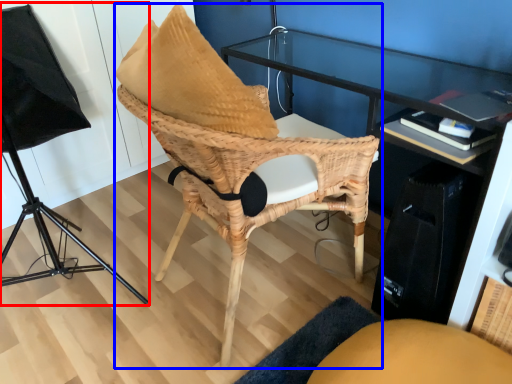
Question: Which point is further to the camera, lamp (highlighted by a red box) or chair (highlighted by a blue box)?

Choices:
 (A) lamp
 (B) chair

Answer: (B)